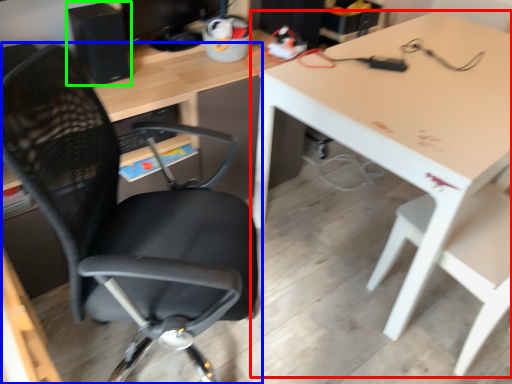
Question: Which object is the farthest from table (highlighted by a red box)? Choose among these: chair (highlighted by a blue box) or computer tower (highlighted by a green box).

Choices:
 (A) chair
 (B) computer tower

Answer: (B)